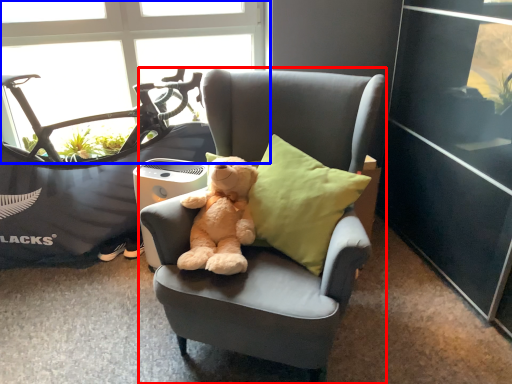
Question: Which object is further to the camera taking this photo, chair (highlighted by a red box) or window (highlighted by a blue box)?

Choices:
 (A) chair
 (B) window

Answer: (B)